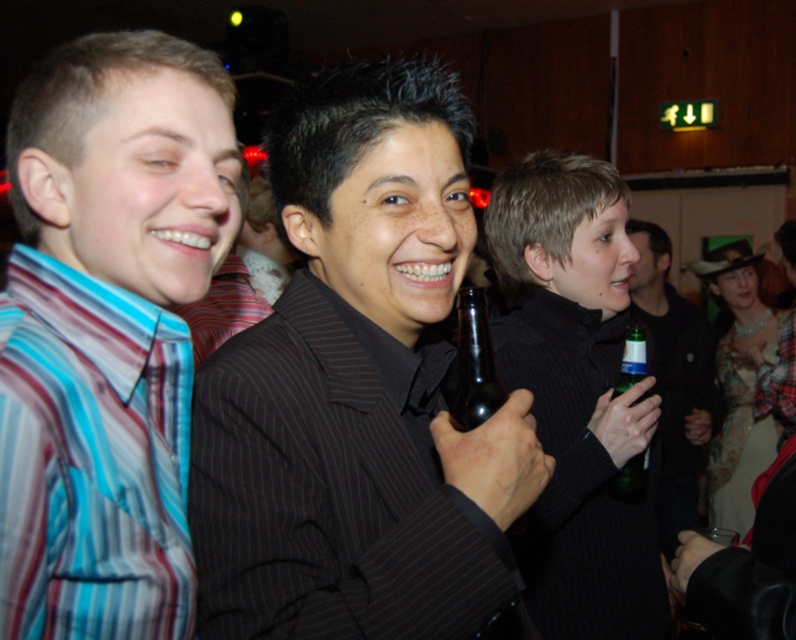
Question: Is green glass bottle at right positioned in front of green glass bottle at center?

Choices:
 (A) yes
 (B) no

Answer: (B)

Question: Among these objects, which one is farthest from the camera?

Choices:
 (A) green glass bottle at right
 (B) matte black suit at center

Answer: (A)

Question: Which point appears closest to the camera in this image?

Choices:
 (A) (209, 344)
 (B) (502, 588)

Answer: (B)

Question: Which of the following is the closest to the observer?

Choices:
 (A) matte black suit at center
 (B) dark pinstripe suit at center
 (C) brown glass bottle at center
 (D) green glass bottle at right

Answer: (B)

Question: Is brown glass bottle at center below green glass bottle at center?

Choices:
 (A) yes
 (B) no

Answer: (B)

Question: Can you confirm if striped cotton shirt at left is thinner than green glass bottle at right?

Choices:
 (A) yes
 (B) no

Answer: (A)